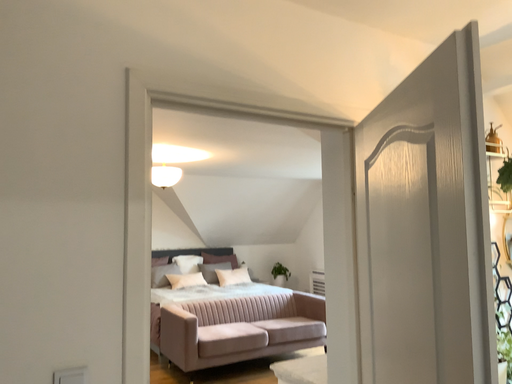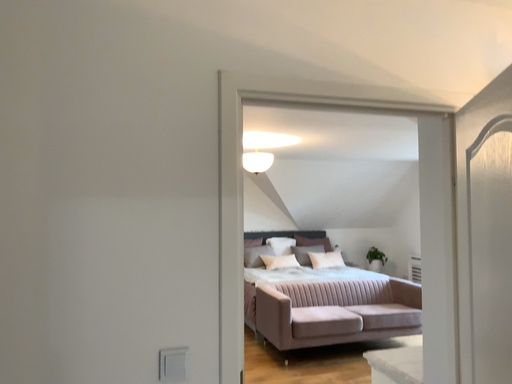
Question: Which way did the camera rotate in the video?

Choices:
 (A) rotated left
 (B) rotated right

Answer: (A)